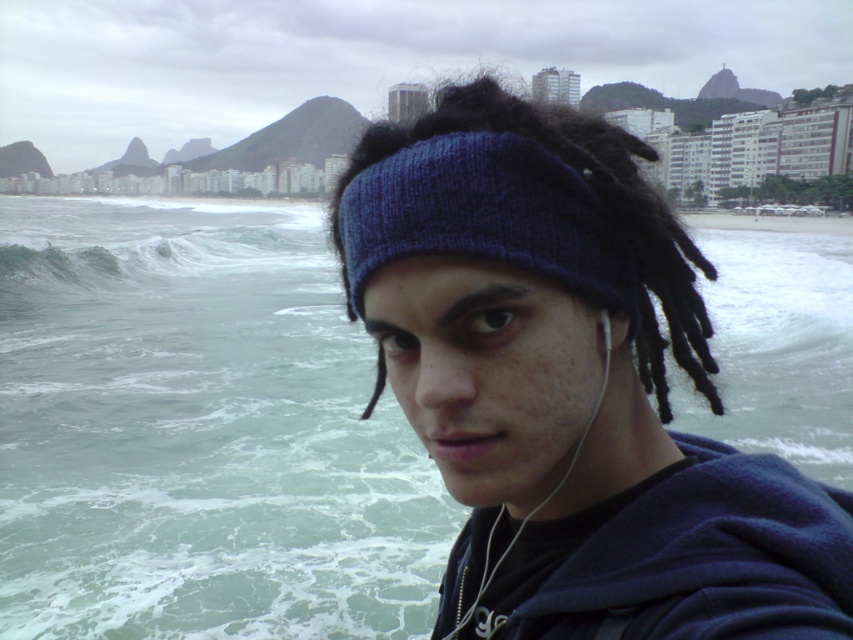
You are a lifeguard on duty at the beach and notice a swimmer struggling in the water. The swimmer is located near the greenish water at lower left. You are standing near the green frothy wave at left. How far apart are the swimmer and you?

The greenish water at lower left and green frothy wave at left are 61.19 feet apart, so the swimmer is approximately 61.19 feet away from you.

You are standing at the point labeled point (216, 477) and want to move towards the point labeled point (32, 216). Given that both points are on the same plane, which direction should you face to move towards the desired point?

Since point (216, 477) is closer to the viewer than point 0.039, 0.039, you should face away from the viewer to move towards the desired point.